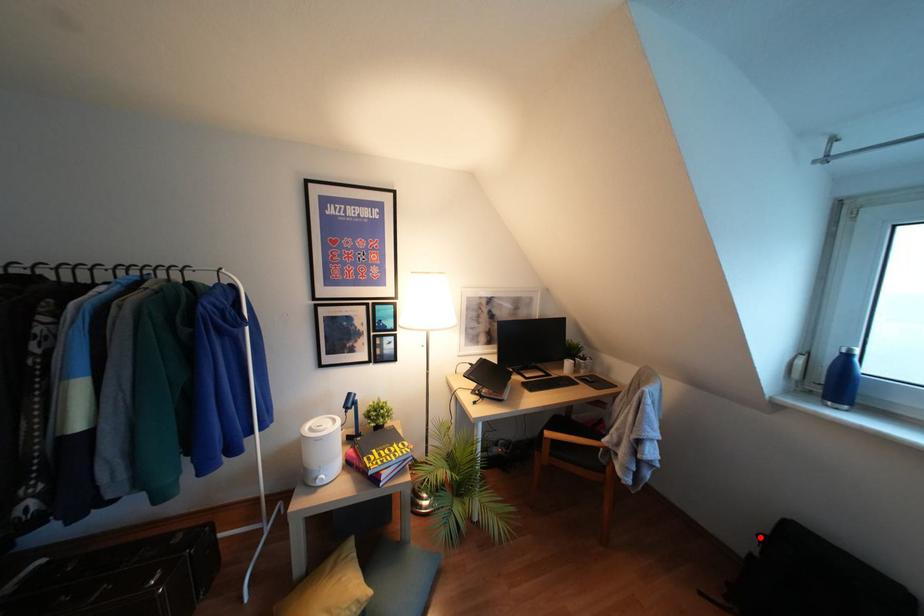
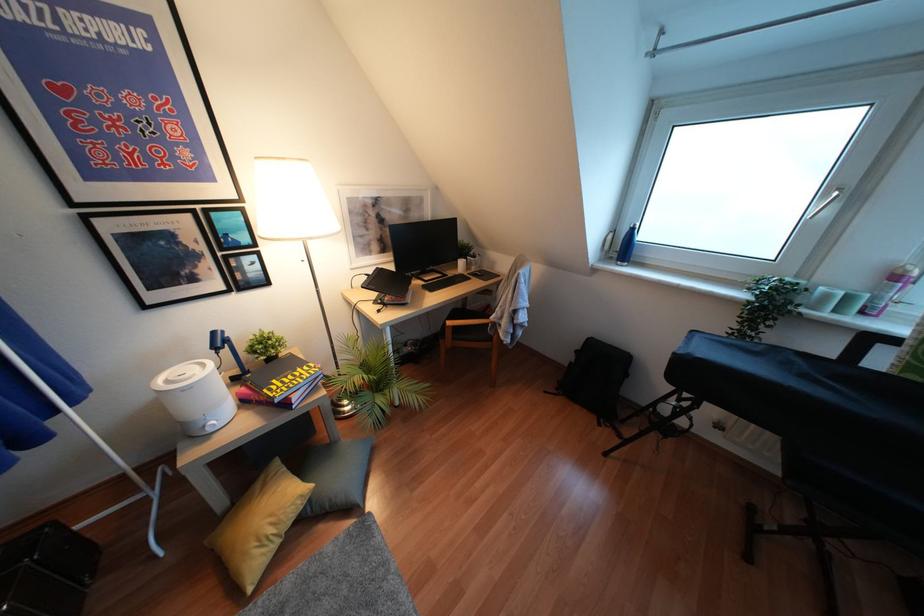
The point at the highlighted location is marked in the first image. Where is the corresponding point in the second image?

(575, 351)